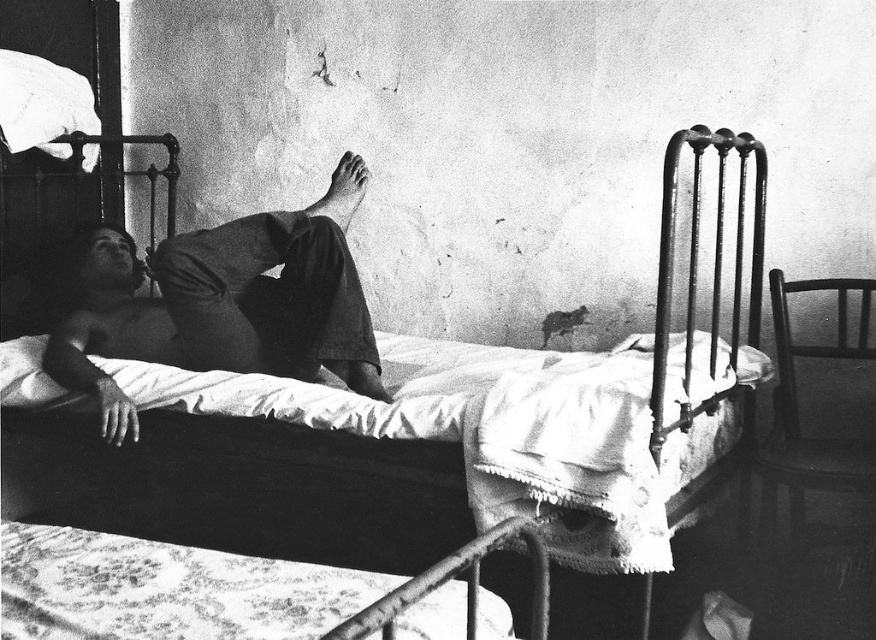
You are standing in the room and want to place a small plant between the two points, point (138, 346) and point (513, 410). Which point should the plant be closer to in order to be closer to the viewer?

The plant should be closer to point (138, 346) because it is further to the viewer than point (513, 410).

You are a photographer analyzing this black and white image. You notice the dark gray fabric shirt at center and the metallic iron bed at center. Based on their positions, which object is closer to the camera?

The dark gray fabric shirt at center is above the metallic iron bed at center, meaning it is closer to the camera.